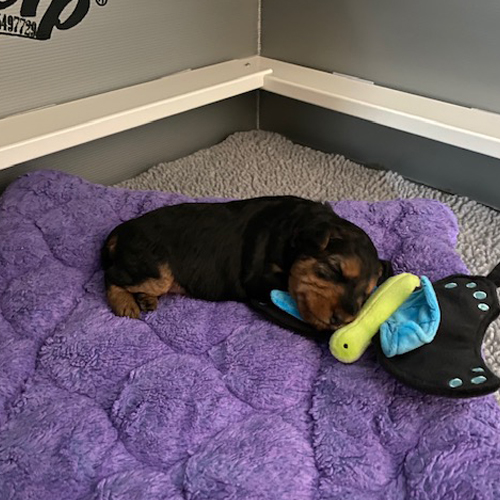
Locate an element on the screen. carpet to the right of dog's bed is located at coordinates tap(480, 257).